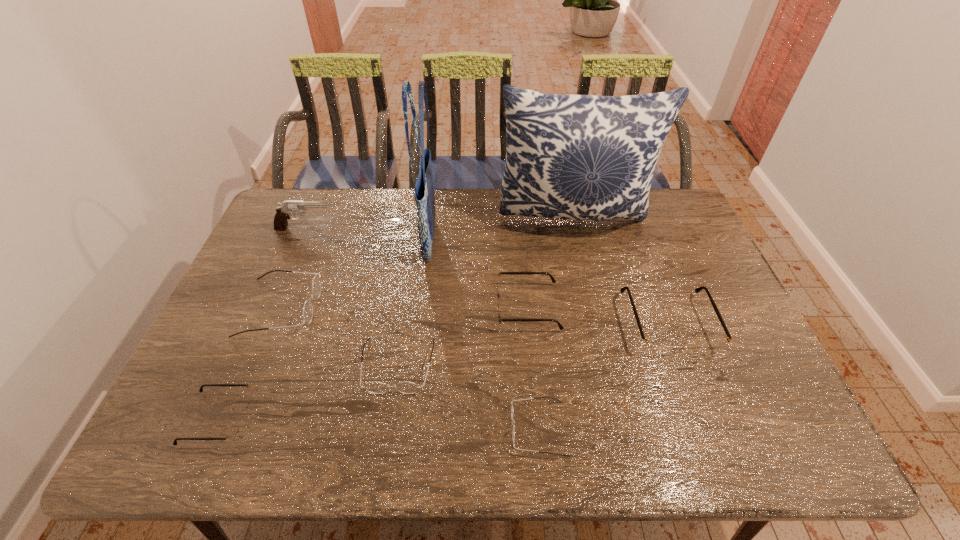
Locate an element on the screen. The width and height of the screenshot is (960, 540). free space between the blue cushion and the shopping bag is located at coordinates (501, 230).

The image size is (960, 540). Find the location of `free space between the second dark spectacles from right to left and the seventh shortest object`. free space between the second dark spectacles from right to left and the seventh shortest object is located at coordinates (351, 298).

At what (x,y) coordinates should I click in order to perform the action: click on unoccupied position between the nearest black spectacles and the fourth spectacles from right to left. Please return your answer as a coordinate pair (x, y). Looking at the image, I should click on (308, 392).

I want to click on vacant area between the rightmost dark spectacles and the smallest black spectacles, so click(x=378, y=424).

At what (x,y) coordinates should I click in order to perform the action: click on free spot between the cushion and the leftmost dark spectacles. Please return your answer as a coordinate pair (x, y). Image resolution: width=960 pixels, height=540 pixels. Looking at the image, I should click on (427, 262).

You are a GUI agent. You are given a task and a screenshot of the screen. Output one action in this format:
    pyautogui.click(x=<x>, y=<y>)
    Task: Click on the vacant space in between the shopping bag and the rightmost spectacles
    
    Given the screenshot: What is the action you would take?
    pyautogui.click(x=549, y=282)

This screenshot has height=540, width=960. Find the location of `free space between the gun and the leftmost dark spectacles`. free space between the gun and the leftmost dark spectacles is located at coordinates (294, 268).

Locate an element on the screen. vacant area that lies between the shopping bag and the gun is located at coordinates (368, 235).

At what (x,y) coordinates should I click in order to perform the action: click on free spot between the leftmost dark spectacles and the rightmost spectacles. Please return your answer as a coordinate pair (x, y). The width and height of the screenshot is (960, 540). Looking at the image, I should click on (474, 316).

Locate an element on the screen. vacant space that is in between the smallest black spectacles and the gun is located at coordinates (262, 324).